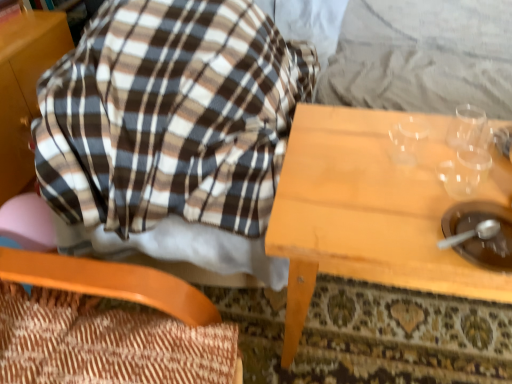
The image size is (512, 384). What are the coordinates of `brown matte bowl at lower right` in the screenshot? It's located at (480, 234).

In order to face brown plaid blanket at upper left, should I rotate leftwards or rightwards?

It's best to rotate left around 7.766 degrees.

I want to click on brown plaid blanket at upper left, so click(170, 116).

Find the location of a particular element. wooden table at center is located at coordinates (365, 213).

The image size is (512, 384). What do you see at coordinates (365, 213) in the screenshot? I see `wooden table at center` at bounding box center [365, 213].

Where is `wooden textured chair at left`? Image resolution: width=512 pixels, height=384 pixels. wooden textured chair at left is located at coordinates (108, 326).

You are a GUI agent. You are given a task and a screenshot of the screen. Output one action in this format:
    pyautogui.click(x=<x>, y=<y>)
    Task: Click on the brown matte bowl at lower right
    The height and width of the screenshot is (384, 512).
    Given the screenshot: What is the action you would take?
    pyautogui.click(x=480, y=234)

Which is nearer, (174,53) or (132,336)?

The point (132,336) is closer to the camera.

How distant is brown plaid blanket at upper left from wooden textured chair at left?

The distance of brown plaid blanket at upper left from wooden textured chair at left is 15.11 inches.

Would you consider brown plaid blanket at upper left to be distant from wooden textured chair at left?

No.

Who is shorter, brown plaid blanket at upper left or wooden textured chair at left?

Standing shorter between the two is wooden textured chair at left.

Consider the image. Is wooden table at center taller or shorter than brown plaid blanket at upper left?

In the image, wooden table at center appears to be shorter than brown plaid blanket at upper left.

Between wooden table at center and brown plaid blanket at upper left, which one appears on the right side from the viewer's perspective?

Positioned to the right is wooden table at center.

From the image's perspective, which is below, wooden table at center or brown plaid blanket at upper left?

wooden table at center is shown below in the image.

Which is less distant, (389, 261) or (129, 113)?

Point (389, 261).

Which of these two, wooden table at center or brown matte bowl at lower right, stands shorter?

brown matte bowl at lower right.

How much distance is there between wooden table at center and brown matte bowl at lower right?

They are 7.84 inches apart.

Considering the relative sizes of wooden table at center and brown matte bowl at lower right in the image provided, is wooden table at center wider than brown matte bowl at lower right?

Correct, the width of wooden table at center exceeds that of brown matte bowl at lower right.

Is brown matte bowl at lower right completely or partially inside wooden table at center?

Yes, wooden table at center contains brown matte bowl at lower right.

Based on their positions, is brown plaid blanket at upper left located to the left or right of wooden table at center?

In the image, brown plaid blanket at upper left appears on the left side of wooden table at center.

Image resolution: width=512 pixels, height=384 pixels. Find the location of `table located below the brown plaid blanket at upper left (from the image's perspective)`. table located below the brown plaid blanket at upper left (from the image's perspective) is located at coordinates (365, 213).

Between brown plaid blanket at upper left and wooden table at center, which one has smaller size?

wooden table at center.

In terms of height, does wooden textured chair at left look taller or shorter compared to brown plaid blanket at upper left?

Considering their sizes, wooden textured chair at left has less height than brown plaid blanket at upper left.

This screenshot has height=384, width=512. I want to click on flannel that is above the wooden textured chair at left (from the image's perspective), so click(x=170, y=116).

Is wooden textured chair at left far away from brown plaid blanket at upper left?

No, there isn't a large distance between wooden textured chair at left and brown plaid blanket at upper left.

From the picture: Does wooden textured chair at left turn towards brown plaid blanket at upper left?

No, wooden textured chair at left is not turned towards brown plaid blanket at upper left.

Is brown matte bowl at lower right bigger than brown plaid blanket at upper left?

No.

Considering their positions, is brown matte bowl at lower right located in front of or behind brown plaid blanket at upper left?

In the image, brown matte bowl at lower right appears behind brown plaid blanket at upper left.

Between brown matte bowl at lower right and brown plaid blanket at upper left, which one appears on the left side from the viewer's perspective?

brown plaid blanket at upper left is more to the left.

Does brown matte bowl at lower right have a greater width compared to brown plaid blanket at upper left?

No.

From a real-world perspective, which is physically above, brown plaid blanket at upper left or brown matte bowl at lower right?

brown matte bowl at lower right.

From the image's perspective, which one is positioned lower, brown plaid blanket at upper left or brown matte bowl at lower right?

From the image's view, brown matte bowl at lower right is below.

Is brown plaid blanket at upper left closer to the viewer compared to brown matte bowl at lower right?

That is True.

Find the location of a particular element. flannel that is on the left side of brown matte bowl at lower right is located at coordinates (170, 116).

Locate an element on the screen. flannel below the wooden textured chair at left (from a real-world perspective) is located at coordinates (170, 116).

At what (x,y) coordinates should I click in order to perform the action: click on table that appears behind the brown plaid blanket at upper left. Please return your answer as a coordinate pair (x, y). Image resolution: width=512 pixels, height=384 pixels. Looking at the image, I should click on (365, 213).

Estimate the real-world distances between objects in this image. Which object is further from wooden table at center, brown plaid blanket at upper left or brown matte bowl at lower right?

Based on the image, brown plaid blanket at upper left appears to be further to wooden table at center.

Based on their spatial positions, is wooden textured chair at left or brown matte bowl at lower right further from brown plaid blanket at upper left?

The object further to brown plaid blanket at upper left is brown matte bowl at lower right.

Considering their positions, is brown plaid blanket at upper left positioned closer to wooden textured chair at left than brown matte bowl at lower right?

Based on the image, brown plaid blanket at upper left appears to be nearer to wooden textured chair at left.

Estimate the real-world distances between objects in this image. Which object is closer to wooden textured chair at left, wooden table at center or brown plaid blanket at upper left?

The object closer to wooden textured chair at left is brown plaid blanket at upper left.

Looking at the image, which one is located closer to wooden table at center, brown matte bowl at lower right or brown plaid blanket at upper left?

Based on the image, brown matte bowl at lower right appears to be nearer to wooden table at center.

Based on their spatial positions, is wooden table at center or wooden textured chair at left closer to brown matte bowl at lower right?

Based on the image, wooden table at center appears to be nearer to brown matte bowl at lower right.

Estimate the real-world distances between objects in this image. Which object is closer to brown plaid blanket at upper left, brown matte bowl at lower right or wooden textured chair at left?

wooden textured chair at left.

Estimate the real-world distances between objects in this image. Which object is further from wooden table at center, wooden textured chair at left or brown matte bowl at lower right?

wooden textured chair at left is positioned further to the anchor wooden table at center.

The height and width of the screenshot is (384, 512). In order to click on tray between wooden textured chair at left and wooden table at center from left to right in this screenshot , I will do `click(480, 234)`.

The image size is (512, 384). What are the coordinates of `flannel between wooden textured chair at left and brown matte bowl at lower right` in the screenshot? It's located at (170, 116).

You are a GUI agent. You are given a task and a screenshot of the screen. Output one action in this format:
    pyautogui.click(x=<x>, y=<y>)
    Task: Click on the flannel between wooden textured chair at left and wooden table at center from left to right
    This screenshot has width=512, height=384.
    Given the screenshot: What is the action you would take?
    pyautogui.click(x=170, y=116)

Image resolution: width=512 pixels, height=384 pixels. What are the coordinates of `tray located between brown plaid blanket at upper left and wooden table at center in the left-right direction` in the screenshot? It's located at (480, 234).